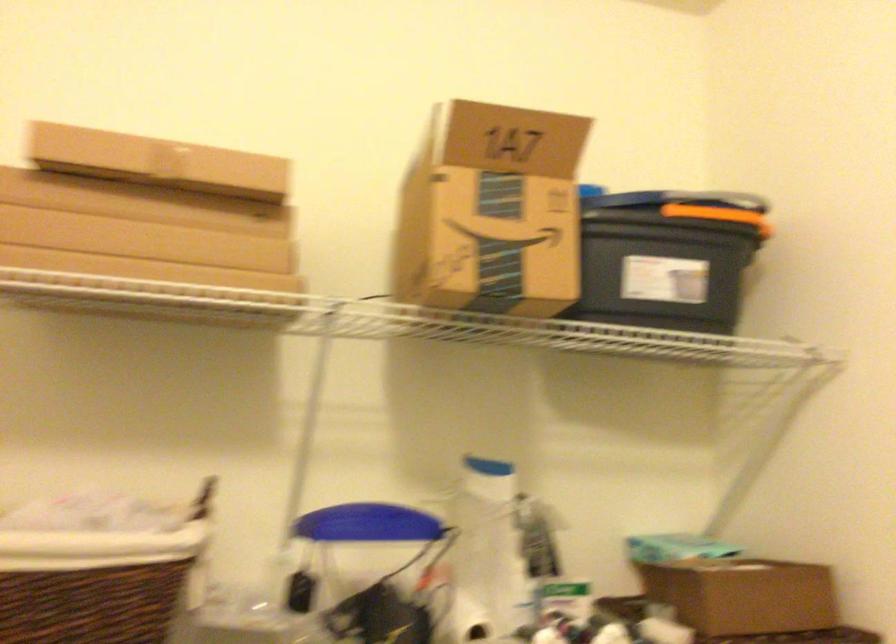
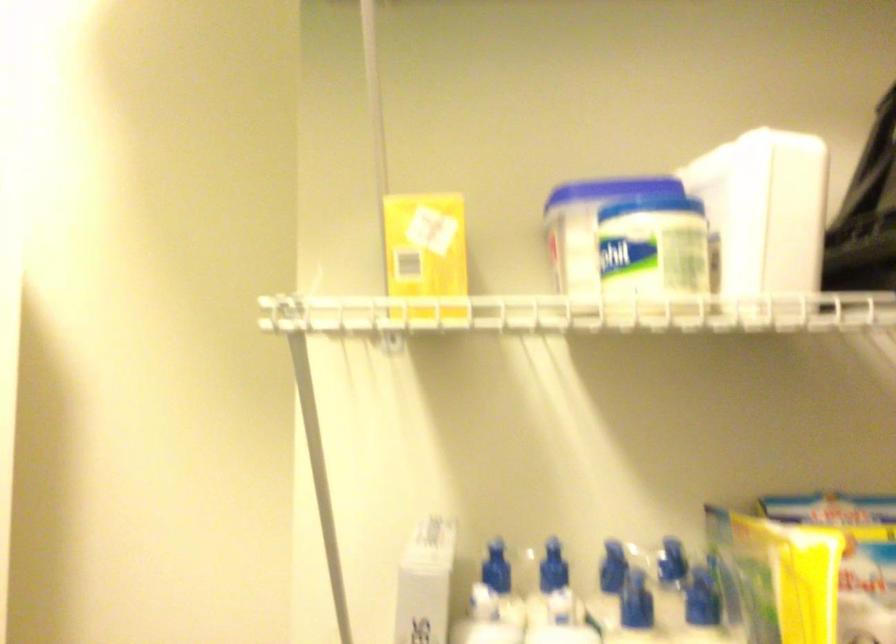
Question: How did the camera likely rotate?

Choices:
 (A) Left
 (B) Right
 (C) Up
 (D) Down

Answer: (B)